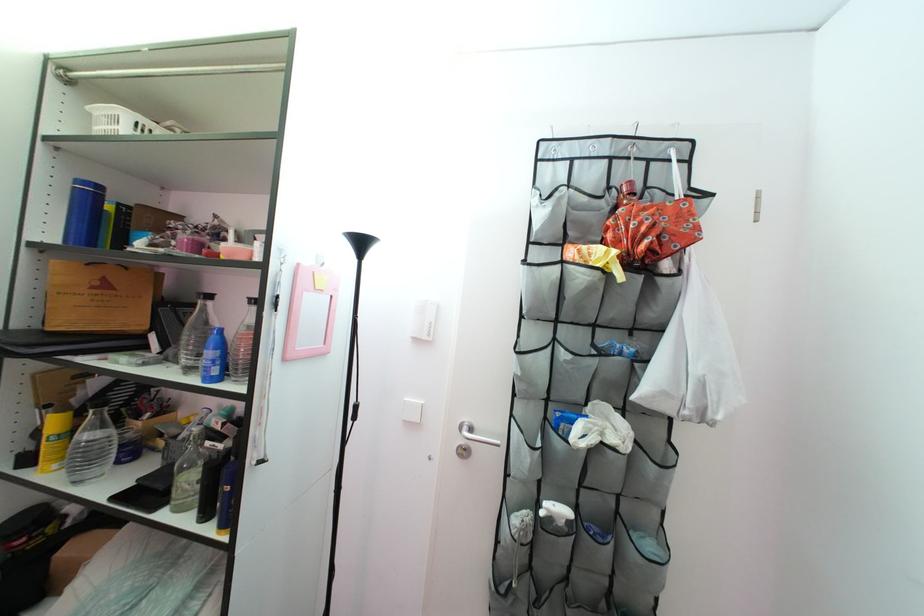
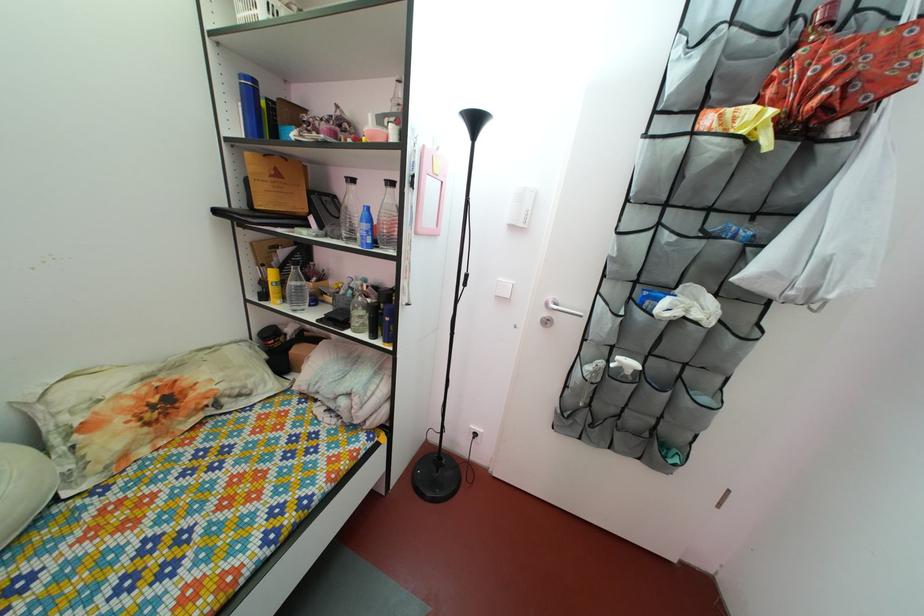
The point at [106,391] is marked in the first image. Where is the corresponding point in the second image?

(292, 262)